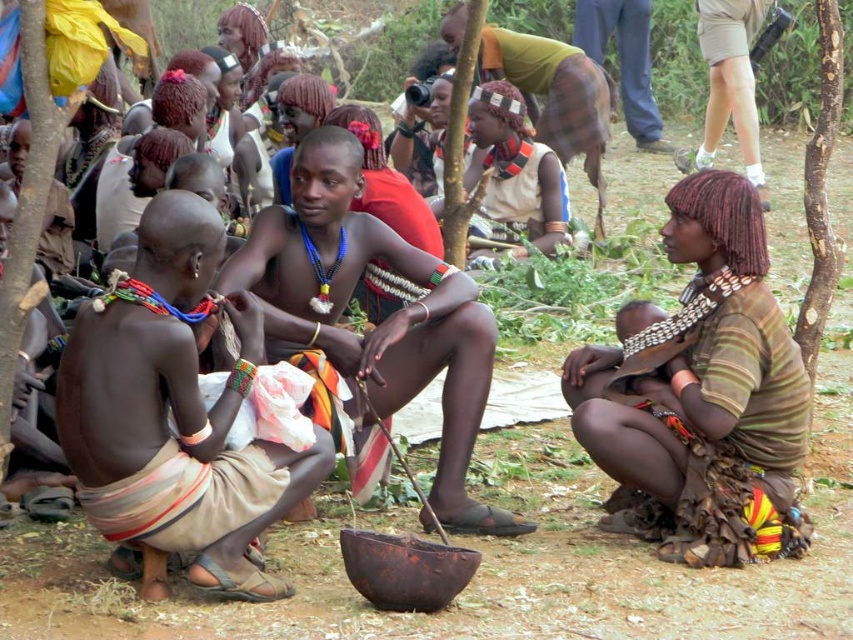
Can you confirm if shiny metallic necklace at center is positioned to the left of khaki shorts at upper right?

Correct, you'll find shiny metallic necklace at center to the left of khaki shorts at upper right.

Who is more forward, [518,524] or [679,160]?

Point [518,524] is more forward.

Between point (293, 307) and point (711, 38), which one is positioned behind?

The point (711, 38) is more distant.

This screenshot has width=853, height=640. Identify the location of shiny metallic necklace at center. (379, 321).

Does shiny metallic necklace at center come behind blue jeans at upper center?

No, shiny metallic necklace at center is in front of blue jeans at upper center.

In the scene shown: Does shiny metallic necklace at center have a lesser height compared to blue jeans at upper center?

Yes.

You are a GUI agent. You are given a task and a screenshot of the screen. Output one action in this format:
    pyautogui.click(x=<x>, y=<y>)
    Task: Click on the shiny metallic necklace at center
    The height and width of the screenshot is (640, 853).
    Given the screenshot: What is the action you would take?
    pyautogui.click(x=379, y=321)

Is brown skin/scarred man at center positioned at the back of blue jeans at upper center?

No, it is in front of blue jeans at upper center.

How distant is brown skin/scarred man at center from blue jeans at upper center?

They are 10.82 meters apart.

This screenshot has width=853, height=640. In order to click on brown skin/scarred man at center in this screenshot , I will do (177, 412).